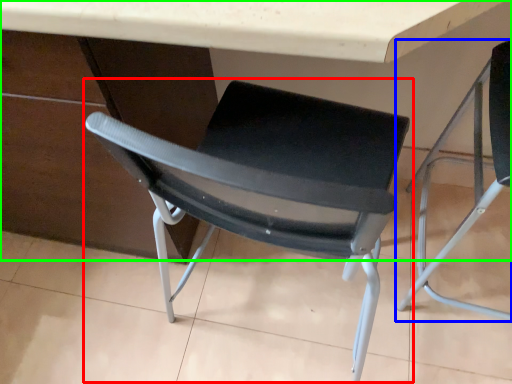
Question: Which object is the closest to the chair (highlighted by a red box)? Choose among these: chair (highlighted by a blue box) or table (highlighted by a green box).

Choices:
 (A) chair
 (B) table

Answer: (B)